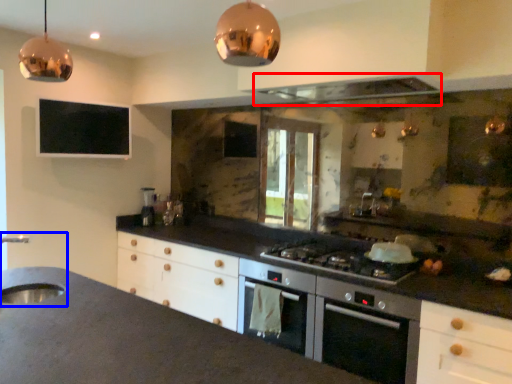
Question: Which object is further to the camera taking this photo, exhaust hood (highlighted by a red box) or sink (highlighted by a blue box)?

Choices:
 (A) exhaust hood
 (B) sink

Answer: (A)